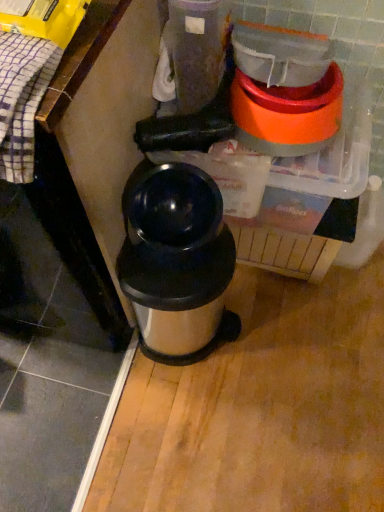
What are the coordinates of `free spot to the left of stainless steel thermos at center` in the screenshot? It's located at (92, 366).